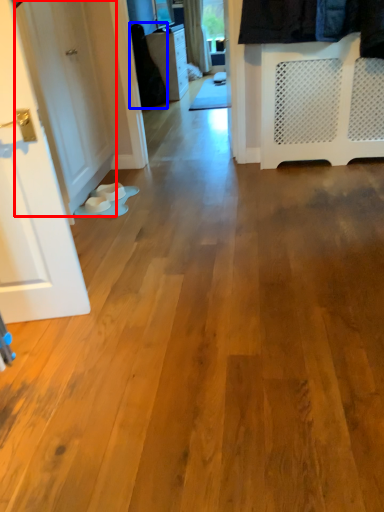
Question: Which of the following is the farthest to the observer, door (highlighted by a red box) or clothing (highlighted by a blue box)?

Choices:
 (A) door
 (B) clothing

Answer: (B)